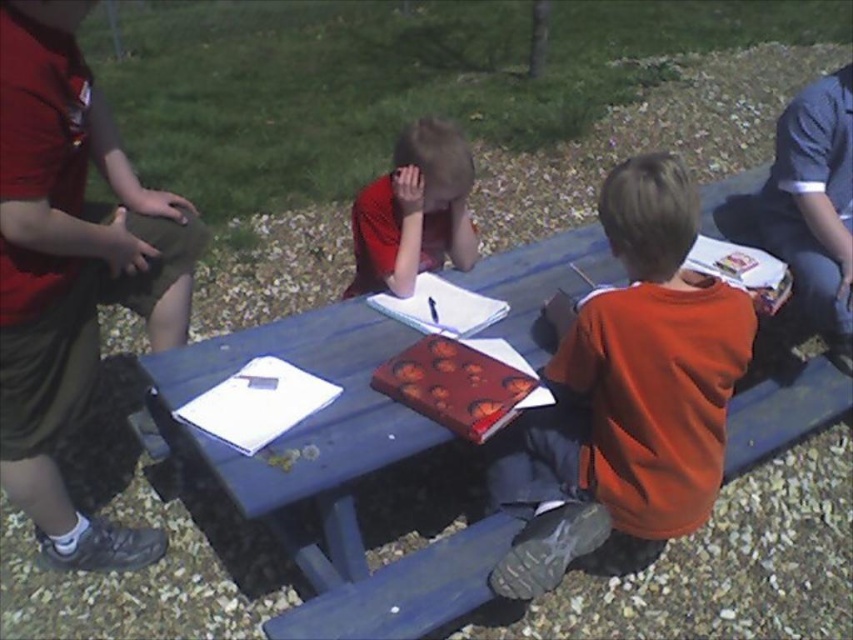
Can you confirm if blue painted wood picnic table at center is shorter than matte red shirt at center?

No, blue painted wood picnic table at center is not shorter than matte red shirt at center.

Which is more to the left, blue painted wood picnic table at center or matte red shirt at center?

Positioned to the left is blue painted wood picnic table at center.

The image size is (853, 640). Describe the element at coordinates (329, 474) in the screenshot. I see `blue painted wood picnic table at center` at that location.

You are a GUI agent. You are given a task and a screenshot of the screen. Output one action in this format:
    pyautogui.click(x=<x>, y=<y>)
    Task: Click on the blue painted wood picnic table at center
    This screenshot has height=640, width=853.
    Given the screenshot: What is the action you would take?
    pyautogui.click(x=329, y=474)

Can you confirm if dark blue jeans at right is shorter than matte red shirt at center?

No.

Is dark blue jeans at right positioned in front of matte red shirt at center?

No, it is not.

Which is behind, point (791, 227) or point (440, 257)?

The point (791, 227) is behind.

Locate an element on the screen. dark blue jeans at right is located at coordinates (815, 205).

Can you confirm if blue painted wood picnic table at center is positioned above orange matte shirt at center?

No, blue painted wood picnic table at center is not above orange matte shirt at center.

Can you confirm if blue painted wood picnic table at center is shorter than orange matte shirt at center?

Indeed, blue painted wood picnic table at center has a lesser height compared to orange matte shirt at center.

Is point (289, 468) less distant than point (699, 477)?

Yes, point (289, 468) is in front of point (699, 477).

Identify the location of blue painted wood picnic table at center. (329, 474).